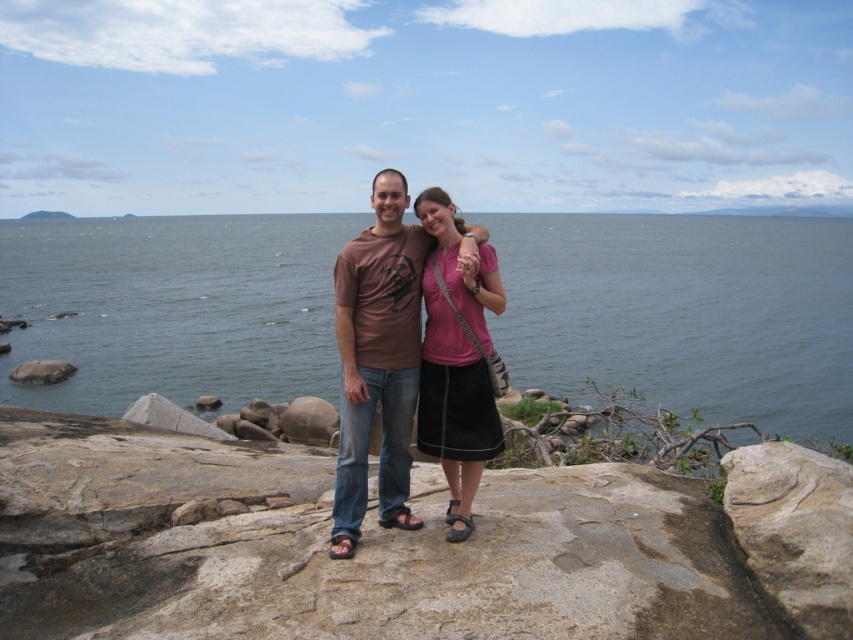
This screenshot has width=853, height=640. Describe the element at coordinates (376, 358) in the screenshot. I see `brown cotton t-shirt at center` at that location.

Which of these two, brown cotton t-shirt at center or gray rough rock at center, stands taller?

Standing taller between the two is brown cotton t-shirt at center.

I want to click on brown cotton t-shirt at center, so click(376, 358).

At what (x,y) coordinates should I click in order to perform the action: click on brown cotton t-shirt at center. Please return your answer as a coordinate pair (x, y). The height and width of the screenshot is (640, 853). Looking at the image, I should click on (376, 358).

Is brown cotton t-shirt at center positioned behind pink fabric skirt at center?

No, it is in front of pink fabric skirt at center.

Does brown cotton t-shirt at center have a greater height compared to pink fabric skirt at center?

Yes, brown cotton t-shirt at center is taller than pink fabric skirt at center.

Which is in front, point (334, 268) or point (428, 358)?

Positioned in front is point (428, 358).

The image size is (853, 640). I want to click on brown cotton t-shirt at center, so click(376, 358).

Which of these two, brown rock at center or gray rock at lower left, stands shorter?

With less height is brown rock at center.

The width and height of the screenshot is (853, 640). Identify the location of brown rock at center. (405, 545).

The height and width of the screenshot is (640, 853). In order to click on brown rock at center in this screenshot , I will do (405, 545).